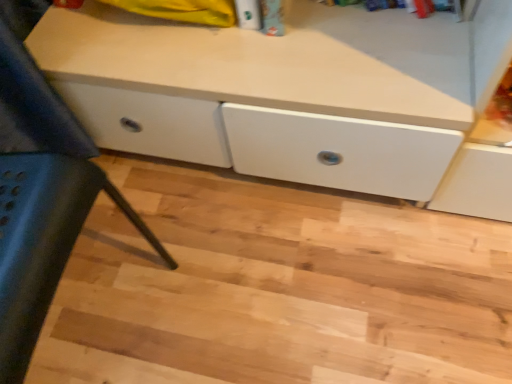
Locate an element on the screen. The image size is (512, 384). vacant region under matte white cabinet at lower left (from a real-world perspective) is located at coordinates (92, 318).